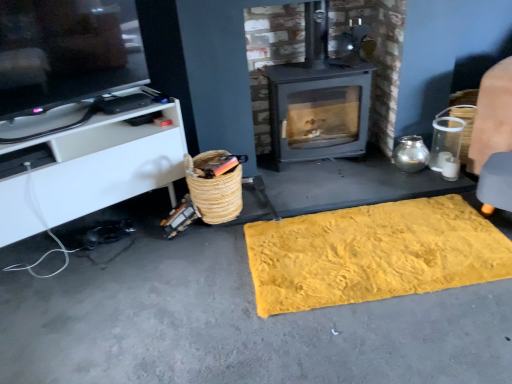
The height and width of the screenshot is (384, 512). In order to click on blank area to the left of woven straw basket at lower left in this screenshot , I will do `click(154, 226)`.